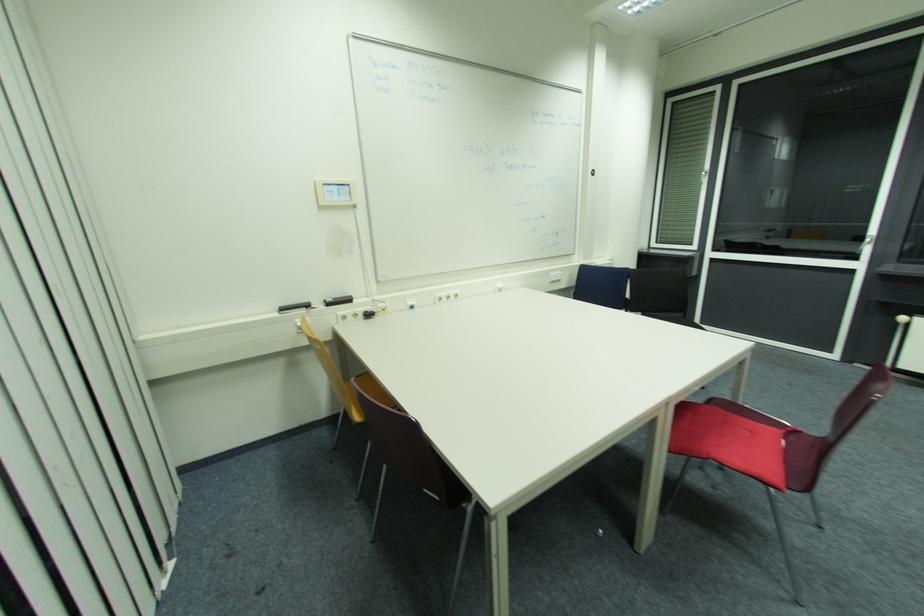
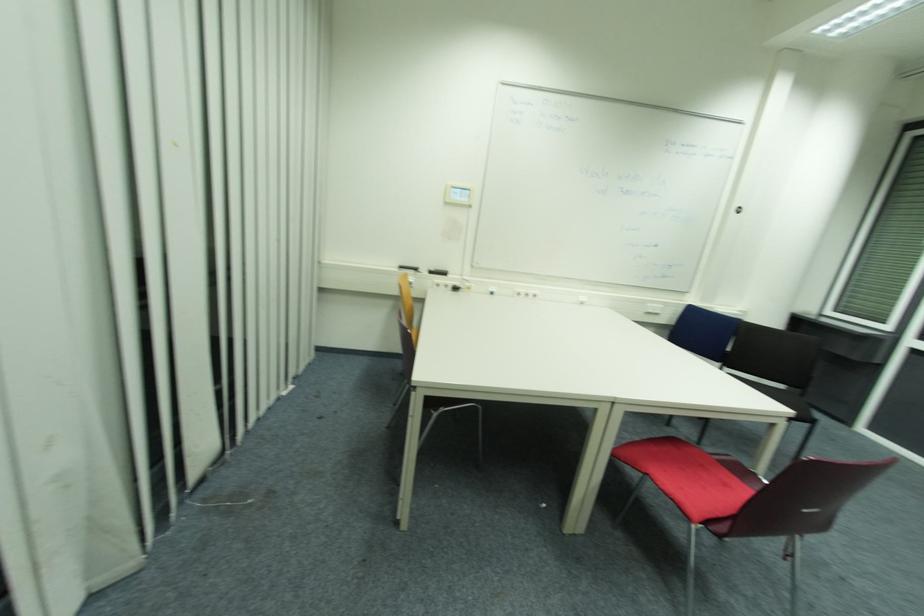
Find the pixel in the second image that matches (x=371, y=315) in the first image.

(458, 290)